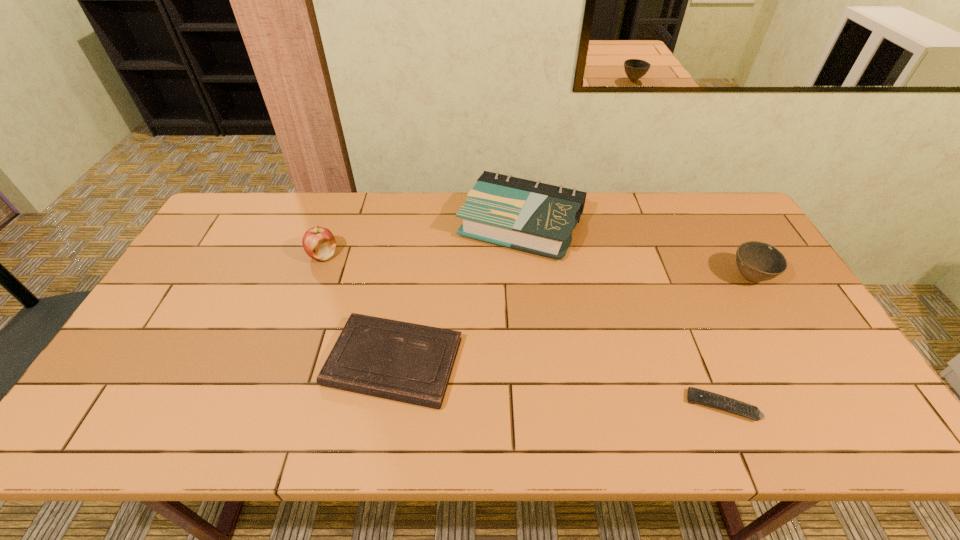
This screenshot has width=960, height=540. What are the coordinates of `vacant space at the far left corner of the desktop` in the screenshot? It's located at (233, 198).

This screenshot has width=960, height=540. Identify the location of free spot between the taller paperback book and the shortest object. (622, 315).

I want to click on empty location between the leftmost object and the third shortest object, so click(537, 266).

Find the location of a particular element. empty space between the nearer paperback book and the fourth object from left to right is located at coordinates (558, 383).

Identify the location of vacant space that's between the bowl and the leftmost object. The height and width of the screenshot is (540, 960). (537, 266).

Where is `free space between the third shortest object and the shorter paperback book`? This screenshot has height=540, width=960. free space between the third shortest object and the shorter paperback book is located at coordinates (571, 320).

What are the coordinates of `free space that is in between the third shortest object and the fourth object from left to right` in the screenshot? It's located at (736, 342).

Locate an element on the screen. The image size is (960, 540). free space between the fourth tallest object and the taller paperback book is located at coordinates (457, 293).

You are a GUI agent. You are given a task and a screenshot of the screen. Output one action in this format:
    pyautogui.click(x=<x>, y=<y>)
    Task: Click on the vacant area that lies between the third shortest object and the nearer paperback book
    Image resolution: width=960 pixels, height=540 pixels.
    Given the screenshot: What is the action you would take?
    pyautogui.click(x=571, y=320)

In order to click on vacant space in between the bowl and the farther paperback book in this screenshot , I will do `click(636, 251)`.